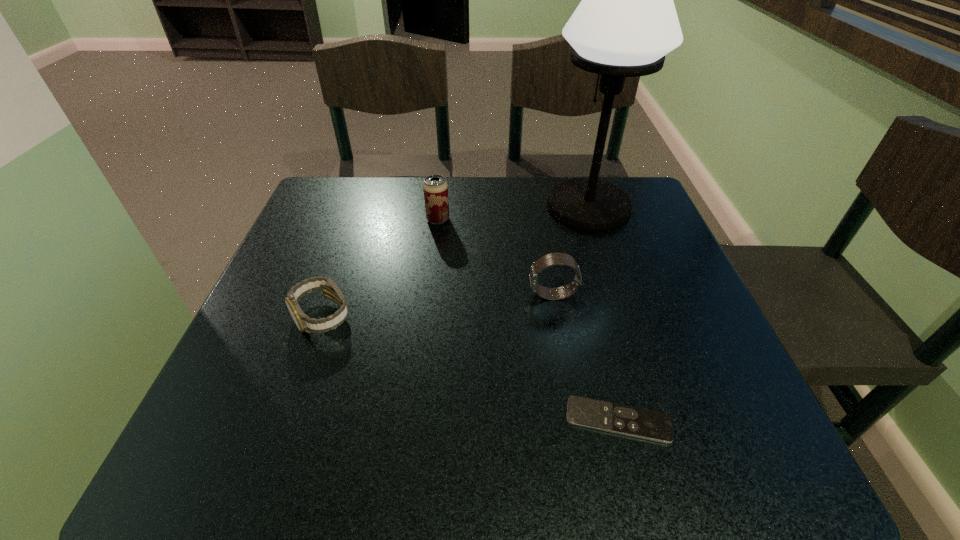
You are a GUI agent. You are given a task and a screenshot of the screen. Output one action in this format:
    pyautogui.click(x=<x>, y=<y>)
    Task: Click on the tallest object
    The image size is (960, 540).
    Given the screenshot: What is the action you would take?
    pyautogui.click(x=626, y=23)

Find the location of a particular element. This screenshot has width=960, height=540. the second object from left to right is located at coordinates (435, 188).

Image resolution: width=960 pixels, height=540 pixels. What are the coordinates of `the right watch` in the screenshot? It's located at (551, 259).

The height and width of the screenshot is (540, 960). Find the location of `the shorter watch`. the shorter watch is located at coordinates (330, 290).

Locate an element on the screen. The width and height of the screenshot is (960, 540). the leftmost object is located at coordinates (330, 290).

The image size is (960, 540). In order to click on the nearest object in this screenshot , I will do `click(642, 423)`.

Identify the location of remote control. (642, 423).

This screenshot has height=540, width=960. I want to click on blank space located 0.130m on the left of the table lamp, so click(493, 207).

Locate an element on the screen. The width and height of the screenshot is (960, 540). vacant space located on the left of the beer can is located at coordinates (370, 220).

Find the location of a particular element. The height and width of the screenshot is (540, 960). free location located on the face of the taller watch is located at coordinates (421, 295).